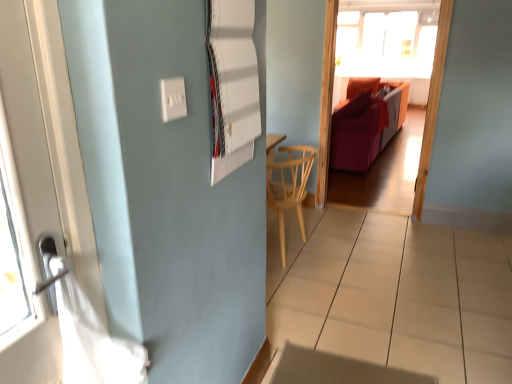
At what (x,y) coordinates should I click in order to perform the action: click on vacant space to the right of light wood chair at center. Please return your answer as a coordinate pair (x, y). Looking at the image, I should click on (360, 263).